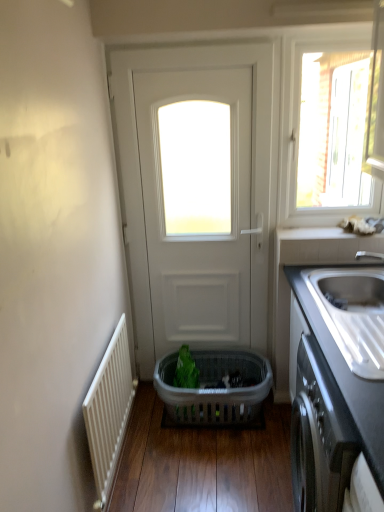
Where is `transparent glass window at upper right`? Image resolution: width=384 pixels, height=512 pixels. transparent glass window at upper right is located at coordinates (323, 132).

What do you see at coordinates (215, 388) in the screenshot? The image size is (384, 512). I see `translucent plastic basket at center` at bounding box center [215, 388].

What do you see at coordinates (353, 314) in the screenshot? I see `satin steel sink at right` at bounding box center [353, 314].

Locate an element on the screen. Image resolution: width=384 pixels, height=512 pixels. green plastic basket at center is located at coordinates (186, 370).

How different are the orientations of translucent plastic basket at center and white ceramic window sill at upper right in degrees?

0.725 degrees.

Identify the location of window sill on the right side of translucent plastic basket at center. (322, 234).

Could you tell me if translucent plastic basket at center is turned towards white ceramic window sill at upper right?

No, translucent plastic basket at center is not oriented towards white ceramic window sill at upper right.

How much distance is there between translucent plastic basket at center and white ceramic window sill at upper right?

translucent plastic basket at center and white ceramic window sill at upper right are 36.90 inches apart from each other.

Based on the photo, is white matte door at center surrounded by green plastic basket at center?

No, white matte door at center is not surrounded by green plastic basket at center.

Considering the relative positions of green plastic basket at center and white matte door at center in the image provided, is green plastic basket at center to the right of white matte door at center from the viewer's perspective?

In fact, green plastic basket at center is to the left of white matte door at center.

Is green plastic basket at center wider than white matte door at center?

No, green plastic basket at center is not wider than white matte door at center.

Is green plastic basket at center further to camera compared to white matte door at center?

Yes, it is.

From a real-world perspective, is white ribbed radiator at left positioned above or below satin steel sink at right?

Clearly, from a real-world perspective, white ribbed radiator at left is below satin steel sink at right.

Does point (118, 460) appear closer or farther from the camera than point (303, 278)?

Point (118, 460).

From the image's perspective, who appears lower, white ribbed radiator at left or satin steel sink at right?

white ribbed radiator at left is shown below in the image.

Which object is positioned more to the right, white ribbed radiator at left or satin steel sink at right?

satin steel sink at right.

Is point (338, 404) closer or farther from the camera than point (181, 392)?

Point (338, 404).

Is black matte cabinet at lower right facing towards translucent plastic basket at center?

No, black matte cabinet at lower right is not turned towards translucent plastic basket at center.

From a real-world perspective, is black matte cabinet at lower right above or below translucent plastic basket at center?

In terms of real-world spatial position, black matte cabinet at lower right is above translucent plastic basket at center.

From a real-world perspective, is satin steel sink at right on white matte door at center?

No, from a real-world perspective, satin steel sink at right is not over white matte door at center

Is satin steel sink at right oriented away from white matte door at center?

No, satin steel sink at right is not facing the opposite direction of white matte door at center.

From the image's perspective, which one is positioned lower, satin steel sink at right or white matte door at center?

satin steel sink at right, from the image's perspective.

Locate an element on the screen. sink below the white matte door at center (from the image's perspective) is located at coordinates (353, 314).

How much distance is there between white matte door at center and green plastic basket at center?

white matte door at center is 31.29 inches from green plastic basket at center.

Is there a large distance between white matte door at center and green plastic basket at center?

white matte door at center is near green plastic basket at center, not far away.

Who is smaller, white matte door at center or green plastic basket at center?

Smaller between the two is green plastic basket at center.

Is white matte door at center to the left or to the right of green plastic basket at center in the image?

white matte door at center is to the right of green plastic basket at center.

Is white ceramic window sill at upper right positioned with its back to green plastic basket at center?

No, white ceramic window sill at upper right is not facing away from green plastic basket at center.

Is white ceramic window sill at upper right inside the boundaries of green plastic basket at center, or outside?

white ceramic window sill at upper right lies outside green plastic basket at center.

Which object is positioned more to the left, white ceramic window sill at upper right or green plastic basket at center?

green plastic basket at center.

Which object is wider, white ceramic window sill at upper right or green plastic basket at center?

With larger width is white ceramic window sill at upper right.

At what (x,y) coordinates should I click in order to perform the action: click on basket below the white ceramic window sill at upper right (from a real-world perspective). Please return your answer as a coordinate pair (x, y). Looking at the image, I should click on (215, 388).

I want to click on door that appears in front of the green plastic basket at center, so click(139, 173).

Considering their positions, is white matte door at center positioned closer to white ceramic window sill at upper right than transparent glass window at upper right?

white matte door at center lies closer to white ceramic window sill at upper right than the other object.

Based on their spatial positions, is white matte door at center or green plastic basket at center closer to translucent plastic basket at center?

green plastic basket at center is closer to translucent plastic basket at center.

Looking at this image, looking at the image, which one is located further to transparent glass window at upper right, satin steel sink at right or green plastic basket at center?

green plastic basket at center lies further to transparent glass window at upper right than the other object.

When comparing their distances from black matte cabinet at lower right, does white matte door at center or white ribbed radiator at left seem closer?

white ribbed radiator at left lies closer to black matte cabinet at lower right than the other object.

Looking at the image, which one is located further to white ribbed radiator at left, black matte cabinet at lower right or transparent glass window at upper right?

The object further to white ribbed radiator at left is transparent glass window at upper right.

Based on their spatial positions, is transparent glass window at upper right or satin steel sink at right further from white ceramic window sill at upper right?

transparent glass window at upper right lies further to white ceramic window sill at upper right than the other object.

Which object lies nearer to the anchor point black matte cabinet at lower right, satin steel sink at right or white ceramic window sill at upper right?

Among the two, satin steel sink at right is located nearer to black matte cabinet at lower right.

Looking at the image, which one is located further to white matte door at center, white ribbed radiator at left or green plastic basket at center?

white ribbed radiator at left is positioned further to the anchor white matte door at center.

Find the location of a particular element. The width and height of the screenshot is (384, 512). spinach between white matte door at center and white ribbed radiator at left in the up-down direction is located at coordinates (186, 370).

At what (x,y) coordinates should I click in order to perform the action: click on radiator between transparent glass window at upper right and black matte cabinet at lower right vertically. Please return your answer as a coordinate pair (x, y). Image resolution: width=384 pixels, height=512 pixels. Looking at the image, I should click on (109, 412).

I want to click on basket positioned between satin steel sink at right and white ceramic window sill at upper right from near to far, so click(x=215, y=388).

Where is `radiator between black matte cabinet at lower right and translucent plastic basket at center in the front-back direction`? Image resolution: width=384 pixels, height=512 pixels. radiator between black matte cabinet at lower right and translucent plastic basket at center in the front-back direction is located at coordinates click(x=109, y=412).